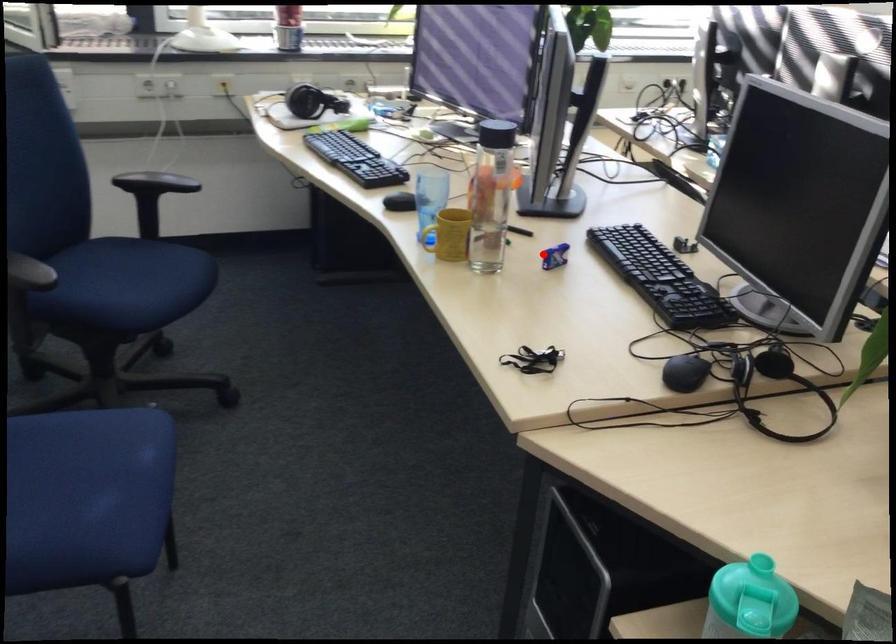
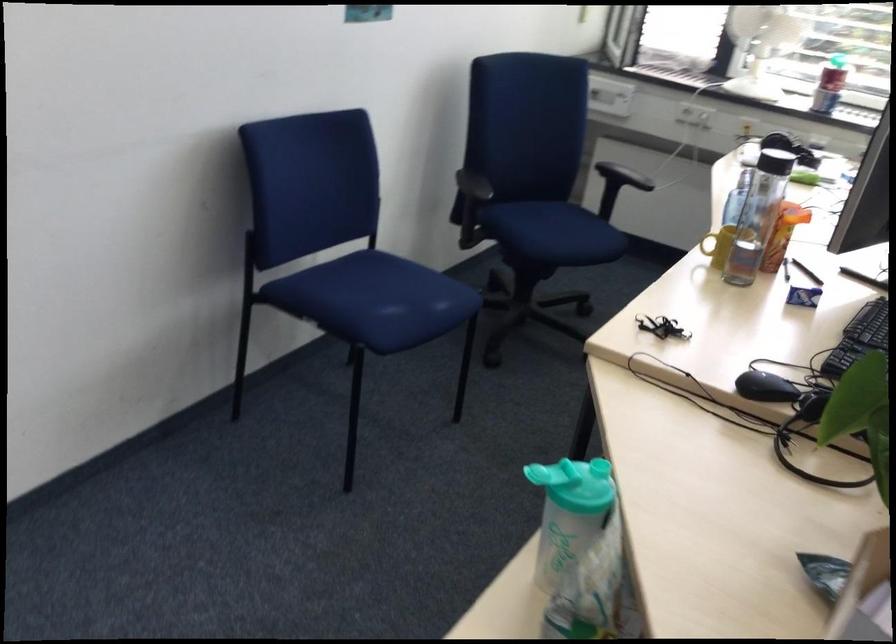
Find the pixel in the second image that matches the highlighted location in the first image.

(803, 297)